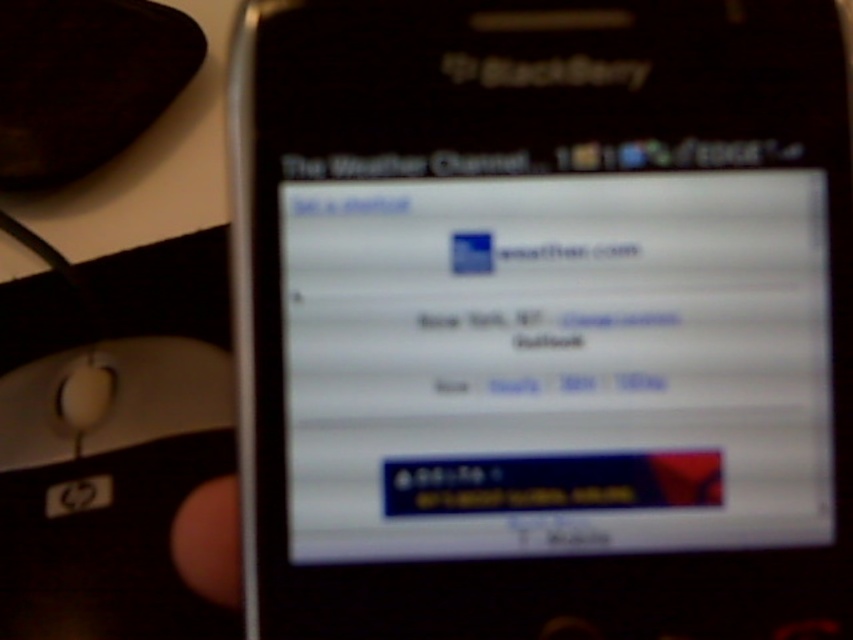
You are setting up a desk workspace and want to place the black matte smartphone at center and the white plastic mouse at lower left. If you need to place a small lamp between them, which object should the lamp be closer to so it doesn

The black matte smartphone at center is taller than the white plastic mouse at lower left. Therefore, the lamp should be placed closer to the white plastic mouse at lower left to ensure it provides adequate lighting to both objects without being obstructed by the taller smartphone.

You are holding a BlackBerry smartphone with the weather app open. You want to tap the location option labeled New York, NY to change it. The location option is at point (x=589, y=374). If your finger is 0.5 inches wide, can you reach it without moving your hand?

The distance between point (x=589, y=374) and the viewer is 14.23 inches. Since your finger is only 0.5 inches wide, you can easily reach the location option labeled New York, NY at point (x=589, y=374) without needing to move your hand.

You are holding a black matte smartphone at center and want to place it on a table. Where should you place it to ensure it is centered on the table?

The black matte smartphone at center is already centered at point (543, 317), so placing it at that coordinate will keep it centered on the table.